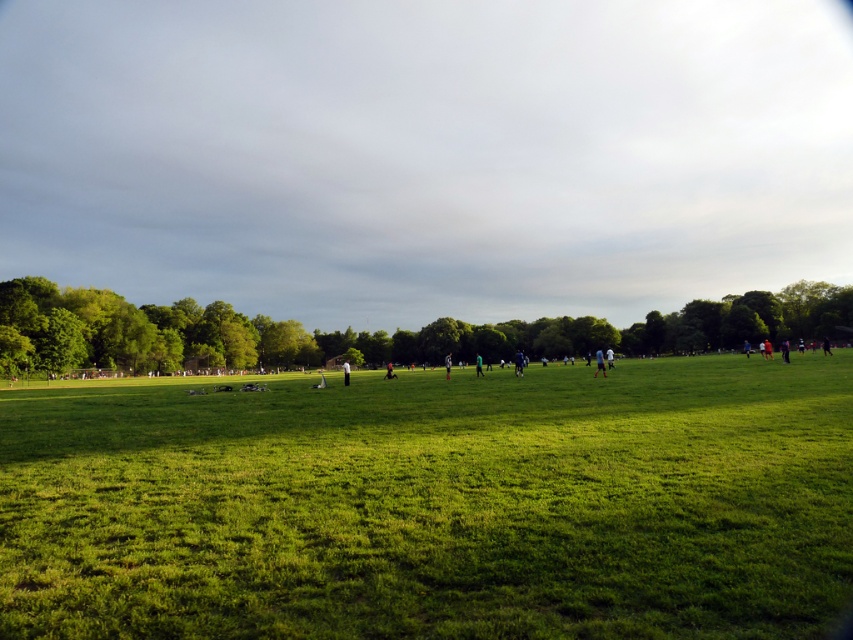
You are standing in the open grassy field and want to take a photo of the dark blue shirt at right without the green leafy tree at lower left blocking the view. Is this possible?

The green leafy tree at lower left is further to the viewer than the dark blue shirt at right, so the tree is closer to you. To avoid the tree blocking the view of the dark blue shirt at right, you would need to move to a position where the tree is not between you and the shirt.

You are standing at the edge of the field and see two people wearing the white cotton shirt at center and the dark blue shirt at center. Which shirt is closer to the left side of the field?

The white cotton shirt at center is positioned on the left side of dark blue shirt at center, so it is closer to the left side of the field.

You are standing in the middle of the open grassy field depicted in the image. You notice a point marked at coordinates [373,332]. What object is located at that point?

The point at coordinates [373,332] indicates a green leafy tree at lower left.